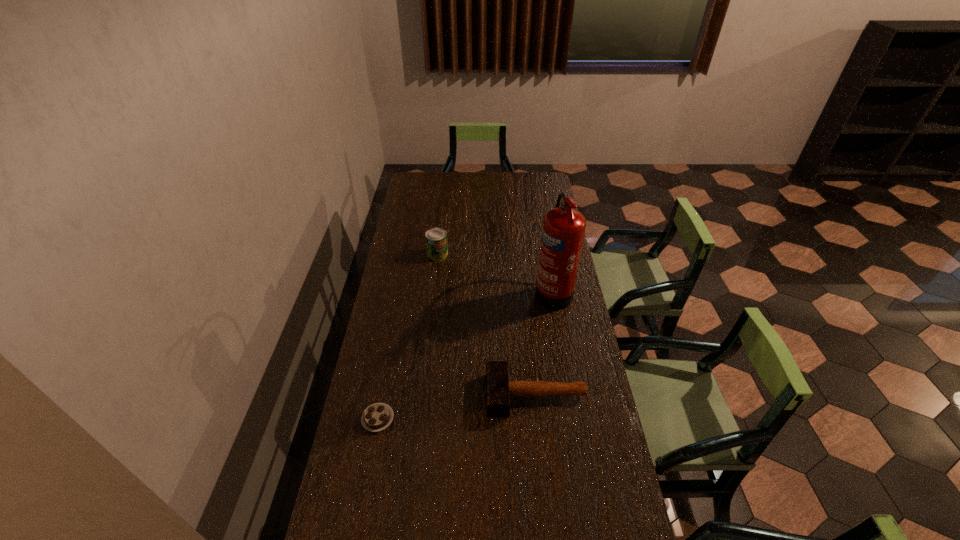
Where is `vacant area situated on the back of the can`? vacant area situated on the back of the can is located at coordinates (444, 204).

Where is `free space located 0.050m on the hammer head face of the mallet`? The image size is (960, 540). free space located 0.050m on the hammer head face of the mallet is located at coordinates (471, 395).

Where is `vacant space positioned 0.050m on the hammer head face of the mallet`? vacant space positioned 0.050m on the hammer head face of the mallet is located at coordinates (471, 395).

Identify the location of blank space located 0.170m on the hammer head face of the mallet. The image size is (960, 540). (436, 395).

Identify the location of vacant space situated 0.170m on the right of the leftmost object. (446, 418).

Find the location of a particular element. The image size is (960, 540). object situated at the left edge is located at coordinates (378, 416).

This screenshot has height=540, width=960. I want to click on fire extinguisher situated at the right edge, so click(563, 229).

Locate an element on the screen. mallet that is at the right edge is located at coordinates (499, 389).

Find the location of a particular element. vacant region at the far edge is located at coordinates (484, 192).

The width and height of the screenshot is (960, 540). What are the coordinates of `free region at the left edge` in the screenshot? It's located at (368, 431).